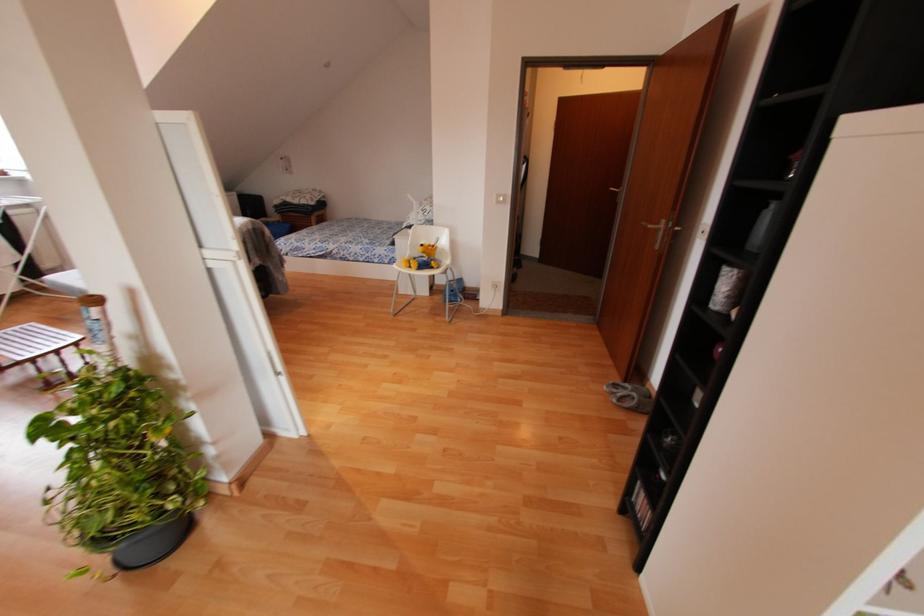
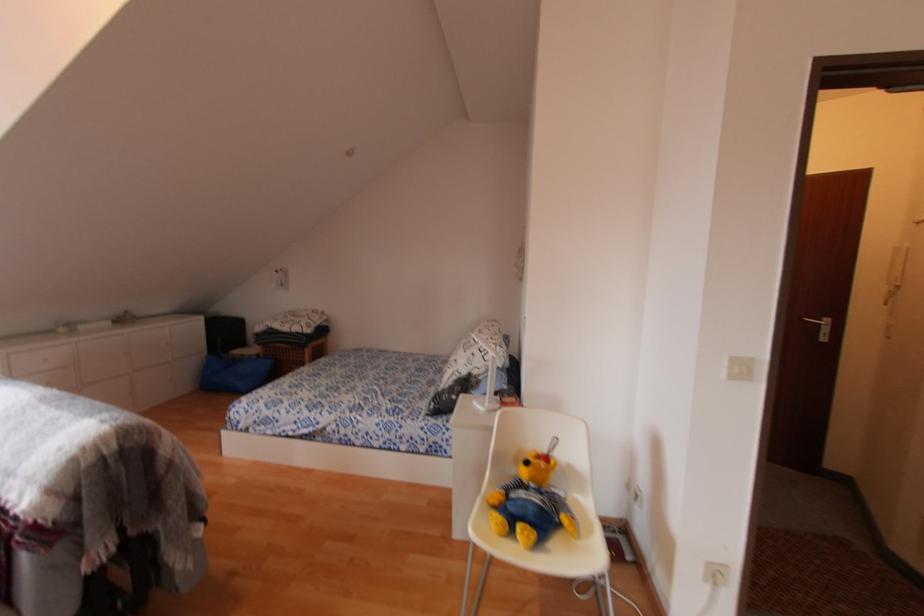
Find the pixel in the second image that matches [499,196] in the first image.

(736, 363)